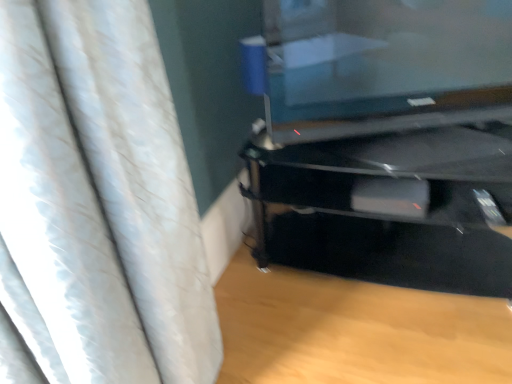
Locate an element on the screen. The height and width of the screenshot is (384, 512). free spot below matte black tv at upper right (from a real-world perspective) is located at coordinates (345, 157).